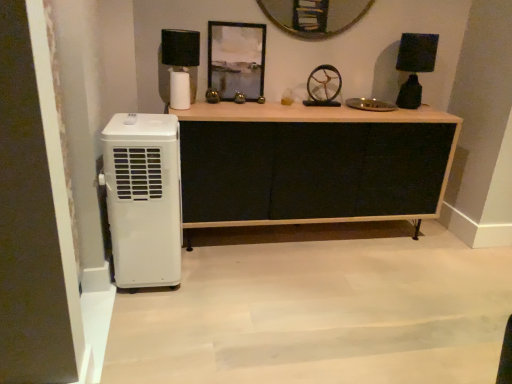
Question: From the image's perspective, is black matte lampshade at upper left, which appears as the second lamp when viewed from the right, positioned above or below black fabric cabinet at center?

Choices:
 (A) below
 (B) above

Answer: (B)

Question: From a real-world perspective, is black matte lampshade at upper left, the first lamp in the left-to-right sequence, positioned above or below black fabric cabinet at center?

Choices:
 (A) above
 (B) below

Answer: (A)

Question: Which is nearer to the metallic gold wheel at center?

Choices:
 (A) white plastic air conditioner at left
 (B) metallic silver frame at upper center
 (C) black matte lamp at right, arranged as the 1th lamp when viewed from the right
 (D) black matte lampshade at upper left, which appears as the second lamp when viewed from the right
 (E) black fabric cabinet at center

Answer: (C)

Question: Which object is the farthest from the white plastic air conditioner at left?

Choices:
 (A) black fabric cabinet at center
 (B) metallic silver frame at upper center
 (C) black matte lamp at right, the second lamp when ordered from left to right
 (D) metallic gold wheel at center
 (E) black matte lampshade at upper left, which appears as the second lamp when viewed from the right

Answer: (C)